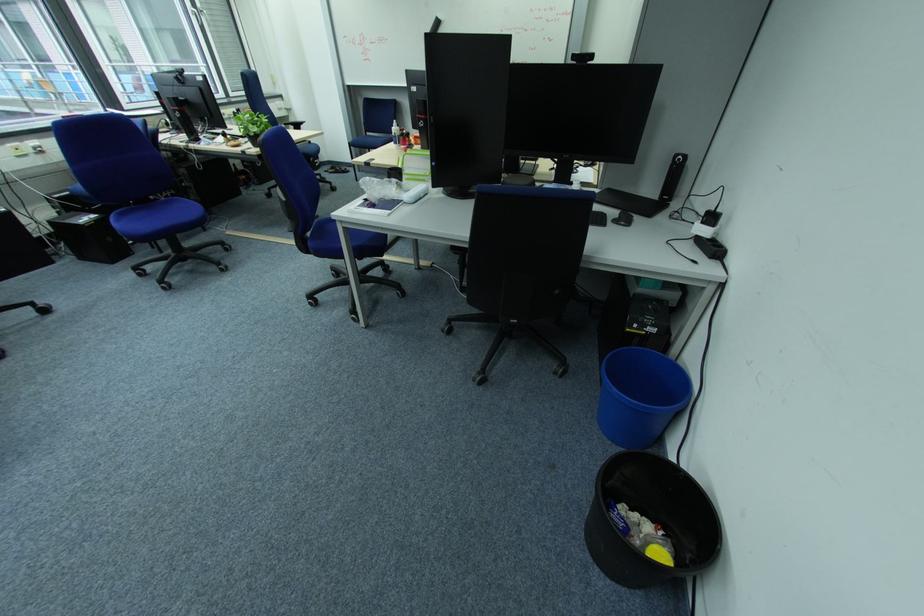
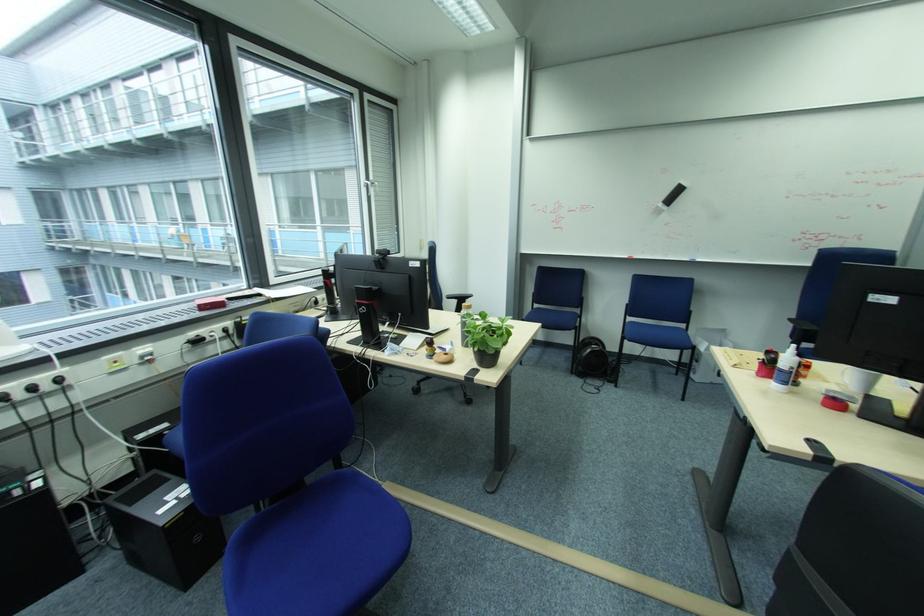
Which direction would the cameraman need to move to produce the second image?

The cameraman moved toward left, forward.